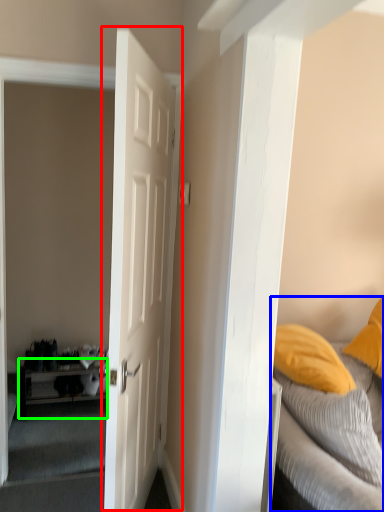
Question: Estimate the real-world distances between objects in this image. Which object is farther from door (highlighted by a red box), bed (highlighted by a blue box) or table (highlighted by a green box)?

Choices:
 (A) bed
 (B) table

Answer: (B)